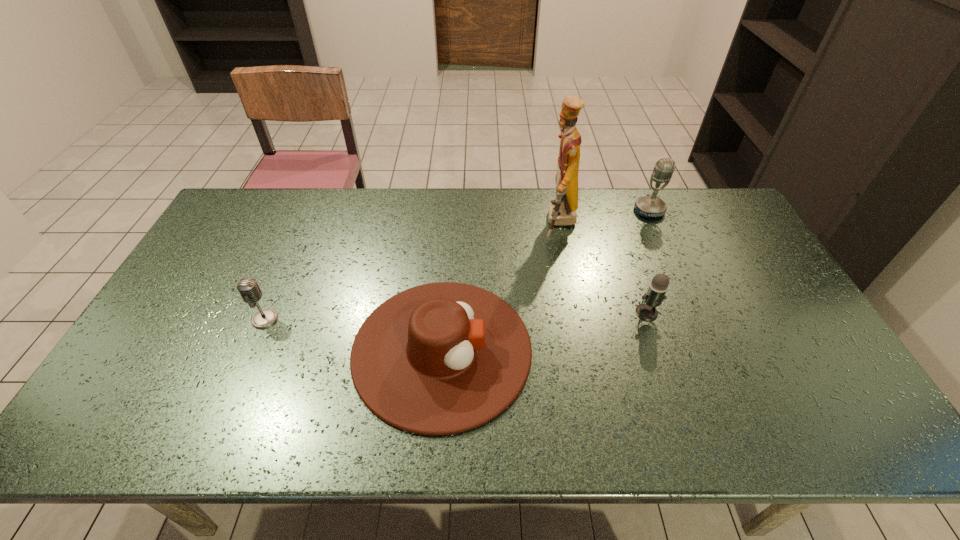
Locate an element on the screen. the tallest object is located at coordinates (562, 212).

At what (x,y) coordinates should I click in order to perform the action: click on nutcracker. Please return your answer as a coordinate pair (x, y). Looking at the image, I should click on (562, 212).

Locate an element on the screen. This screenshot has width=960, height=540. the rightmost object is located at coordinates (647, 206).

I want to click on the tallest microphone, so [647, 206].

Find the location of a particular element. the second microphone from left to right is located at coordinates (655, 294).

Locate an element on the screen. The width and height of the screenshot is (960, 540). the leftmost microphone is located at coordinates (248, 288).

Find the location of a particular element. This screenshot has height=540, width=960. cowboy hat is located at coordinates (441, 358).

Locate an element on the screen. the shortest object is located at coordinates (441, 358).

You are a GUI agent. You are given a task and a screenshot of the screen. Output one action in this format:
    pyautogui.click(x=<x>, y=<y>)
    Task: Click on the vacant point located on the front-facing side of the nutcracker
    This screenshot has height=540, width=960.
    Given the screenshot: What is the action you would take?
    pyautogui.click(x=514, y=223)

Find the location of a particular element. This screenshot has width=960, height=540. blank area located on the front-facing side of the nutcracker is located at coordinates (461, 223).